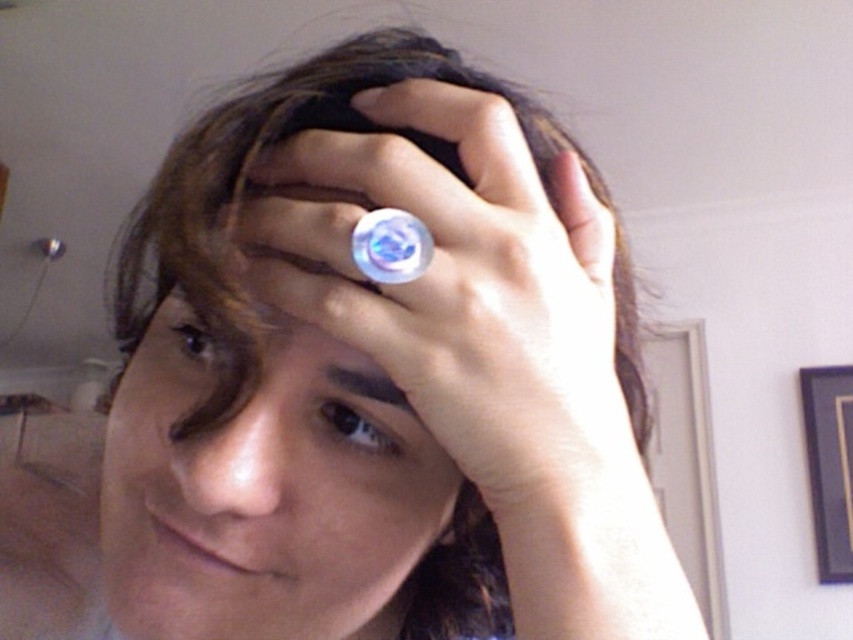
You are a photographer adjusting your camera settings. You notice the smooth skin face at center and the brown glossy eye at upper left in your viewfinder. Which object is positioned more to the right side of the frame?

The smooth skin face at center is positioned more to the right side of the frame compared to the brown glossy eye at upper left.

You are a photographer trying to capture the reflection of the transparent plastic ring at center and the brown glossy eye at upper left. Which object will have a larger reflection in the photo?

The transparent plastic ring at center is bigger than the brown glossy eye at upper left, so its reflection will also be larger.

You are a photographer adjusting the lighting in the room. You notice the brown glossy eye at upper left and the satin black eye at center. Which eye should you focus on to ensure proper exposure, considering their size difference?

The brown glossy eye at upper left is bigger than the satin black eye at center, so focusing on the brown glossy eye at upper left would ensure proper exposure due to its larger size capturing more light.